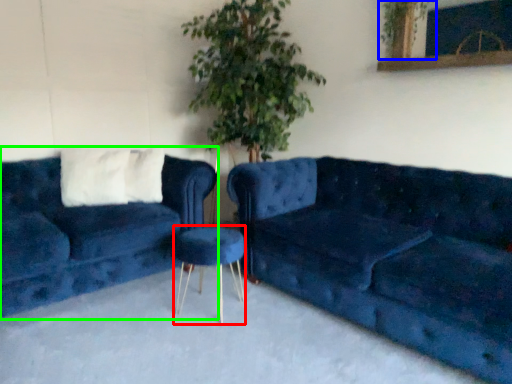
Question: Estimate the real-world distances between objects in this image. Which object is farther from bar stool (highlighted by a red box), plant (highlighted by a blue box) or studio couch (highlighted by a green box)?

Choices:
 (A) plant
 (B) studio couch

Answer: (A)